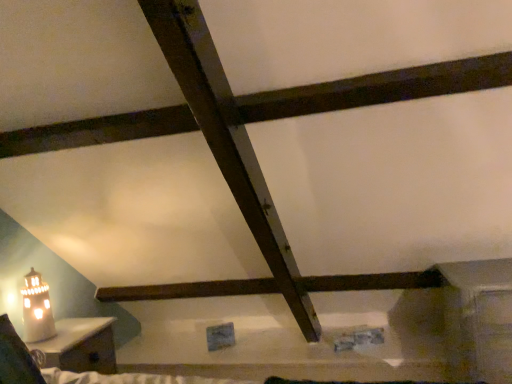
Question: In terms of width, does matte wooden nightstand at lower left look wider or thinner when compared to white ceramic table lamp at lower left?

Choices:
 (A) thin
 (B) wide

Answer: (B)

Question: In terms of height, does matte wooden nightstand at lower left look taller or shorter compared to white ceramic table lamp at lower left?

Choices:
 (A) short
 (B) tall

Answer: (B)

Question: From the image's perspective, is matte wooden nightstand at lower left located above or below white ceramic table lamp at lower left?

Choices:
 (A) below
 (B) above

Answer: (A)

Question: Considering the positions of white ceramic table lamp at lower left and matte wooden nightstand at lower left in the image, is white ceramic table lamp at lower left bigger or smaller than matte wooden nightstand at lower left?

Choices:
 (A) big
 (B) small

Answer: (B)

Question: Would you say white ceramic table lamp at lower left is to the left or to the right of matte wooden nightstand at lower left in the picture?

Choices:
 (A) left
 (B) right

Answer: (A)

Question: From the image's perspective, is white ceramic table lamp at lower left located above or below matte wooden nightstand at lower left?

Choices:
 (A) below
 (B) above

Answer: (B)

Question: From their relative heights in the image, would you say white ceramic table lamp at lower left is taller or shorter than matte wooden nightstand at lower left?

Choices:
 (A) tall
 (B) short

Answer: (B)